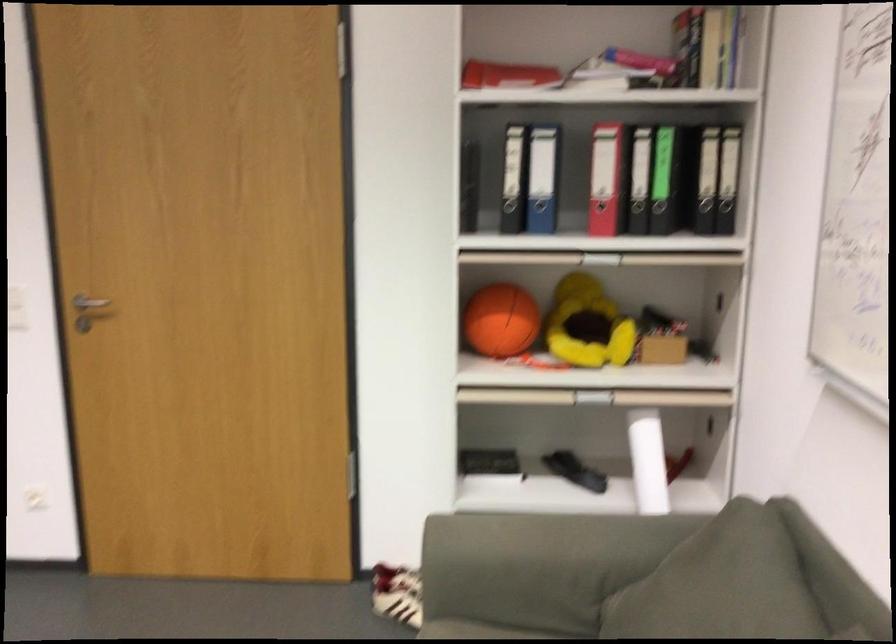
I want to click on metal door handle, so click(x=88, y=305).